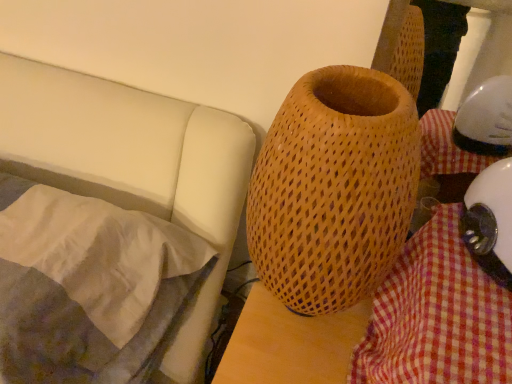
Where is `vacant region above checkered fabric at lower right (from a real-world perspective)`? vacant region above checkered fabric at lower right (from a real-world perspective) is located at coordinates (463, 289).